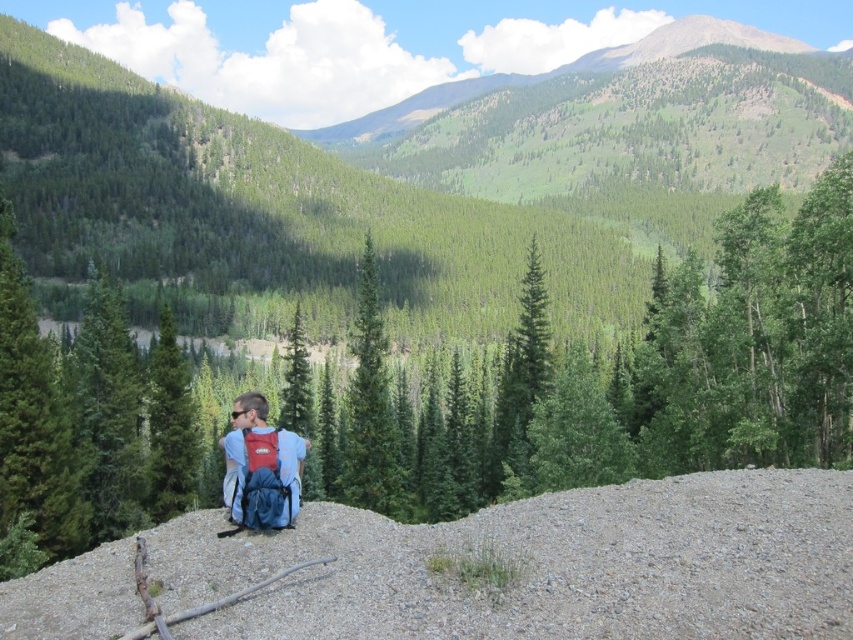
Question: Based on their relative distances, which object is farther from the green matte tree at center?

Choices:
 (A) matte blue backpack at center
 (B) green textured tree at center

Answer: (A)

Question: Does green textured tree at center appear on the left side of matte blue backpack at center?

Choices:
 (A) no
 (B) yes

Answer: (A)

Question: Which point is closer to the camera taking this photo?

Choices:
 (A) (834, 259)
 (B) (352, 470)

Answer: (A)

Question: Is green matte tree at center further to camera compared to matte blue backpack at center?

Choices:
 (A) yes
 (B) no

Answer: (A)

Question: Is green textured tree at center smaller than green matte tree at center?

Choices:
 (A) yes
 (B) no

Answer: (B)

Question: Estimate the real-world distances between objects in this image. Which object is closer to the matte blue backpack at center?

Choices:
 (A) green textured tree at center
 (B) green matte tree at center

Answer: (B)